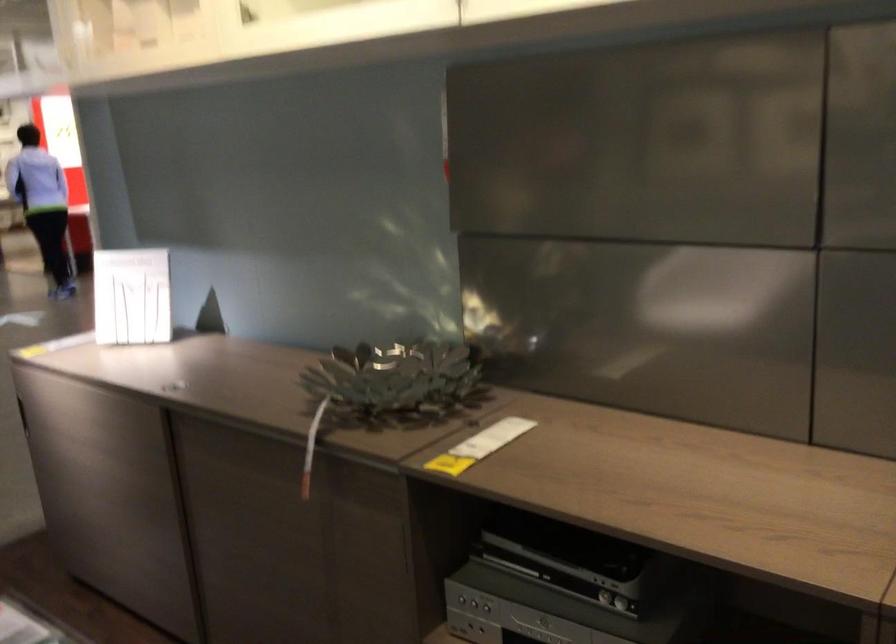
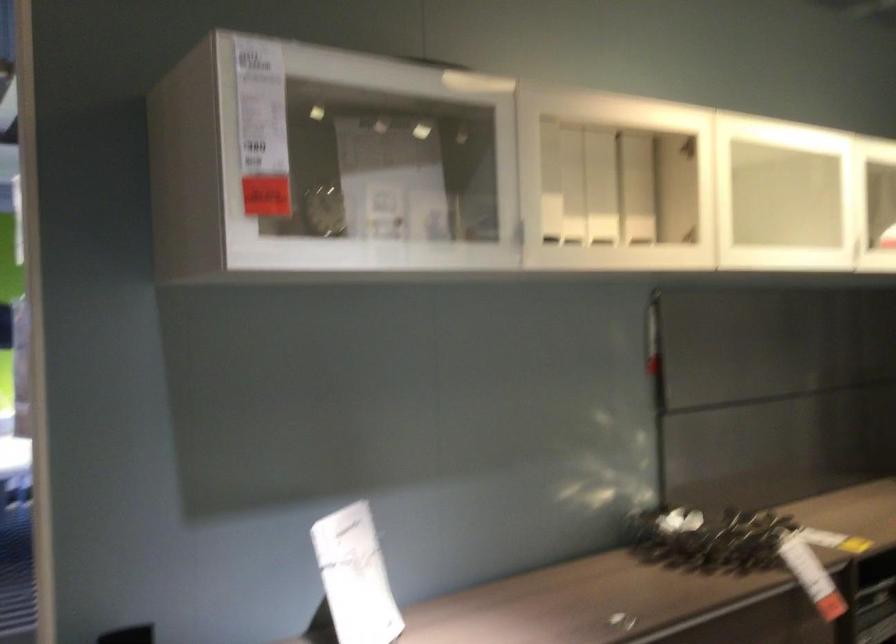
Find the pixel in the second image that matches [130,290] in the first image.

(355, 576)